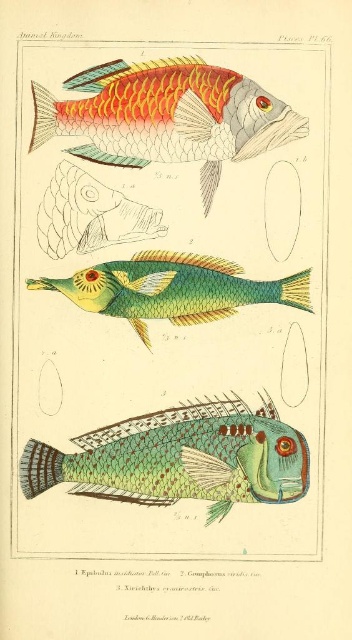
Between green textured fish at upper center and shiny orange scales at upper center, which one is positioned higher?

shiny orange scales at upper center is above.

Between green textured fish at upper center and shiny orange scales at upper center, which one appears on the left side from the viewer's perspective?

From the viewer's perspective, green textured fish at upper center appears more on the left side.

Where is `green textured fish at upper center`? The height and width of the screenshot is (640, 352). green textured fish at upper center is located at coordinates (161, 220).

Can you confirm if green textured fish at lower center is wider than green iridescent fish at center?

Yes, green textured fish at lower center is wider than green iridescent fish at center.

Who is taller, green textured fish at lower center or green iridescent fish at center?

green textured fish at lower center is taller.

Who is more distant from viewer, [98,436] or [103,278]?

The point [103,278] is more distant.

This screenshot has width=352, height=640. In order to click on green textured fish at lower center in this screenshot , I will do `click(180, 458)`.

Does shiny orange scales at upper center have a lesser width compared to green iridescent fish at center?

Correct, shiny orange scales at upper center's width is less than green iridescent fish at center's.

Can you confirm if shiny orange scales at upper center is positioned below green iridescent fish at center?

No.

Is point (242, 154) in front of point (273, 289)?

Yes, point (242, 154) is in front of point (273, 289).

Where is `shiny orange scales at upper center`? shiny orange scales at upper center is located at coordinates (166, 116).